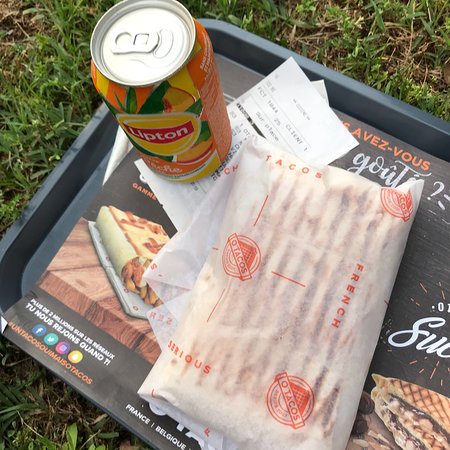
The image size is (450, 450). Identify the location of tray liner paper. (120, 193).